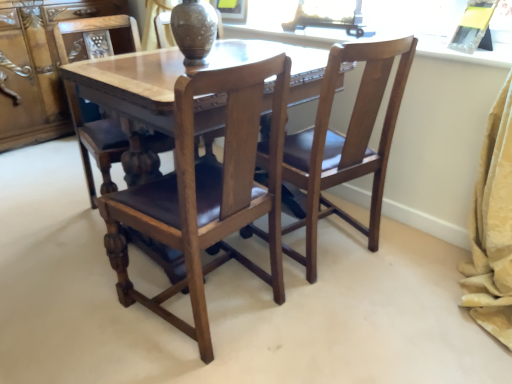
Question: From a real-world perspective, is wooden cabinet at left above or below wooden polished table at center?

Choices:
 (A) above
 (B) below

Answer: (A)

Question: Considering the positions of wooden cabinet at left and wooden polished table at center in the image, is wooden cabinet at left wider or thinner than wooden polished table at center?

Choices:
 (A) thin
 (B) wide

Answer: (A)

Question: Based on their relative distances, which object is nearer to the polished wood chair at center, the 2th chair when ordered from right to left?

Choices:
 (A) wooden chair at center, which appears as the third chair when viewed from the left
 (B) brown matte vase at center
 (C) wooden polished table at center
 (D) brown leather chair at center, which is counted as the first chair, starting from the left
 (E) wooden cabinet at left

Answer: (C)

Question: Which object is positioned farthest from the polished wood chair at center, the 2th chair when ordered from right to left?

Choices:
 (A) wooden cabinet at left
 (B) wooden polished table at center
 (C) brown matte vase at center
 (D) brown leather chair at center, positioned as the 3th chair in right-to-left order
 (E) wooden chair at center, which appears as the third chair when viewed from the left

Answer: (A)